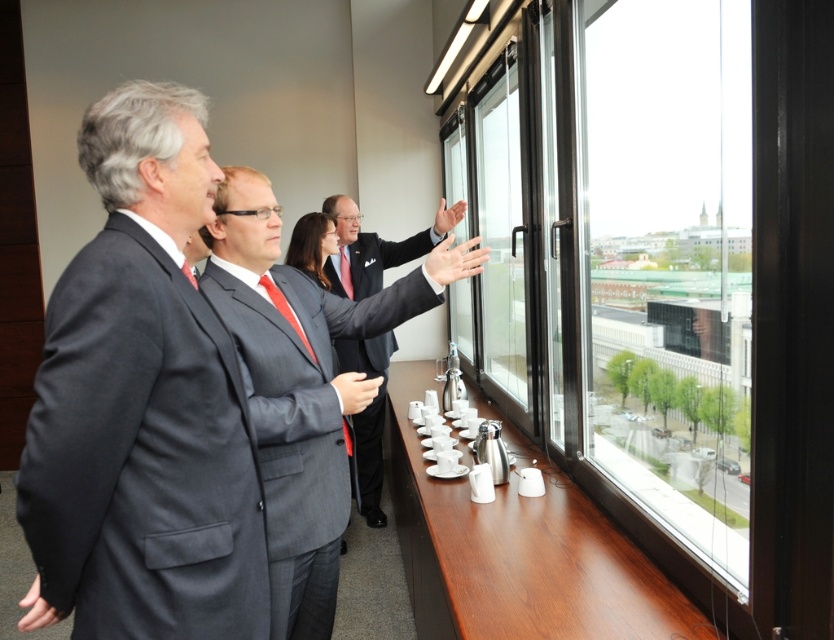
From the picture: Is matte gray suit at center wider than dark gray suit at center?

Indeed, matte gray suit at center has a greater width compared to dark gray suit at center.

From the picture: Which is below, matte gray suit at center or dark gray suit at center?

dark gray suit at center is lower down.

The image size is (834, 640). I want to click on matte gray suit at center, so click(304, 385).

Who is higher up, dark gray suit at left or matte gray suit at center?

dark gray suit at left is higher up.

Describe the element at coordinates (142, 403) in the screenshot. The width and height of the screenshot is (834, 640). I see `dark gray suit at left` at that location.

Who is more forward, [83,616] or [330,424]?

Positioned in front is point [83,616].

Find the location of `dark gray suit at left`. dark gray suit at left is located at coordinates (142, 403).

Is the position of dark gray suit at left less distant than that of dark gray suit at center?

Yes, it is in front of dark gray suit at center.

Between dark gray suit at left and dark gray suit at center, which one is positioned higher?

dark gray suit at left is above.

Between point (84, 364) and point (420, 243), which one is positioned behind?

The point (420, 243) is behind.

Locate an element on the screen. This screenshot has height=640, width=834. dark gray suit at left is located at coordinates (142, 403).